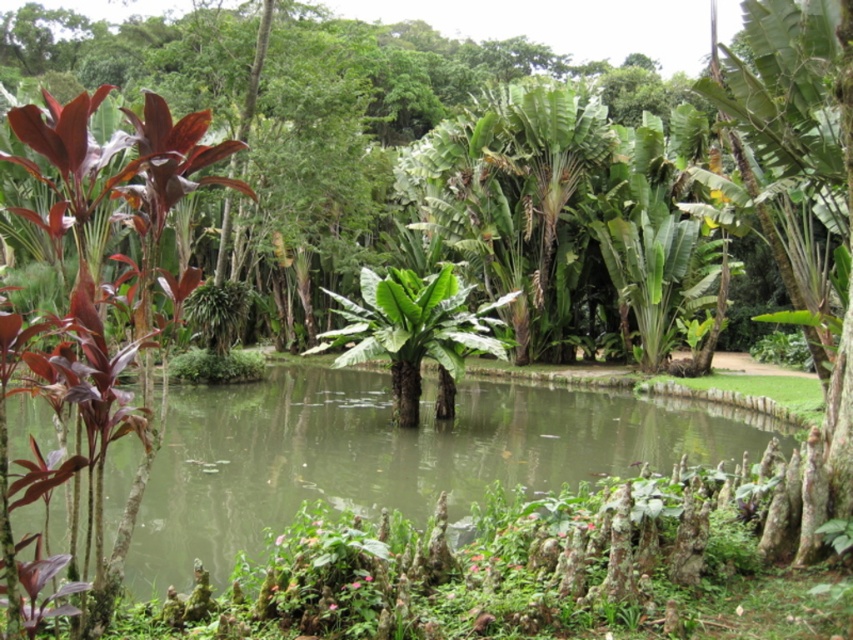
Question: Can you confirm if green murky water at center is positioned to the right of shiny burgundy leaf at left?

Choices:
 (A) no
 (B) yes

Answer: (B)

Question: Among these points, which one is nearest to the camera?

Choices:
 (A) (155, 557)
 (B) (86, 170)

Answer: (B)

Question: Which point is closer to the camera?

Choices:
 (A) green murky water at center
 (B) shiny burgundy leaf at left

Answer: (B)

Question: Is green murky water at center to the right of shiny burgundy leaf at left from the viewer's perspective?

Choices:
 (A) no
 (B) yes

Answer: (B)

Question: Which of the following is the closest to the observer?

Choices:
 (A) shiny burgundy leaf at left
 (B) green murky water at center

Answer: (A)

Question: Is green murky water at center wider than shiny burgundy leaf at left?

Choices:
 (A) yes
 (B) no

Answer: (A)